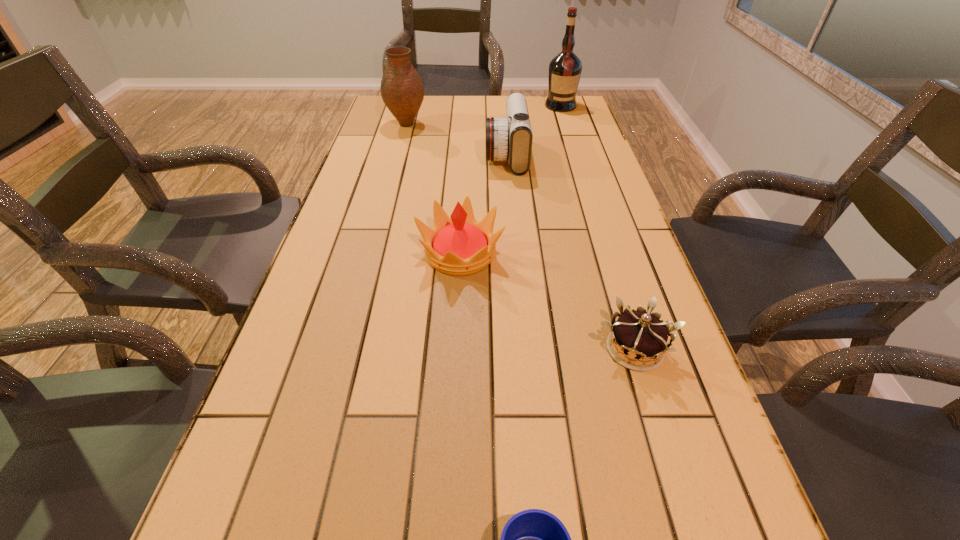
Identify the location of vacant area that lies between the farthest object and the camcorder. (534, 131).

Locate an element on the screen. The image size is (960, 540). the fourth closest object to the second tallest object is located at coordinates (642, 335).

At what (x,y) coordinates should I click in order to perform the action: click on object that is the closest to the liquor. Please return your answer as a coordinate pair (x, y). This screenshot has height=540, width=960. Looking at the image, I should click on (509, 138).